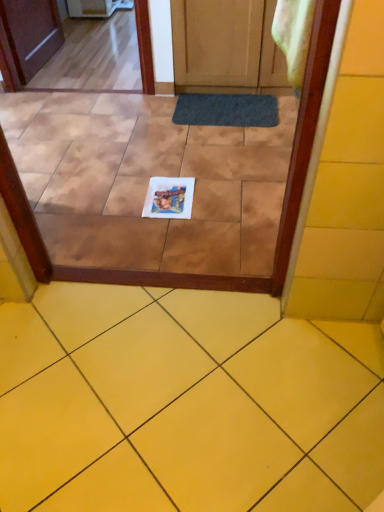
At what (x,y) coordinates should I click in order to perform the action: click on vacant region to the left of white glossy coaster at center. Please return your answer as a coordinate pair (x, y). Looking at the image, I should click on (120, 199).